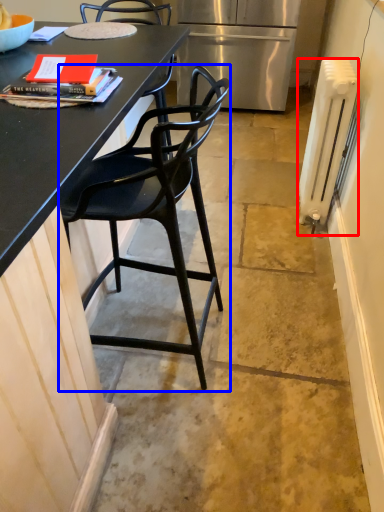
Question: Which of the following is the farthest to the observer, radiator (highlighted by a red box) or chair (highlighted by a blue box)?

Choices:
 (A) radiator
 (B) chair

Answer: (A)